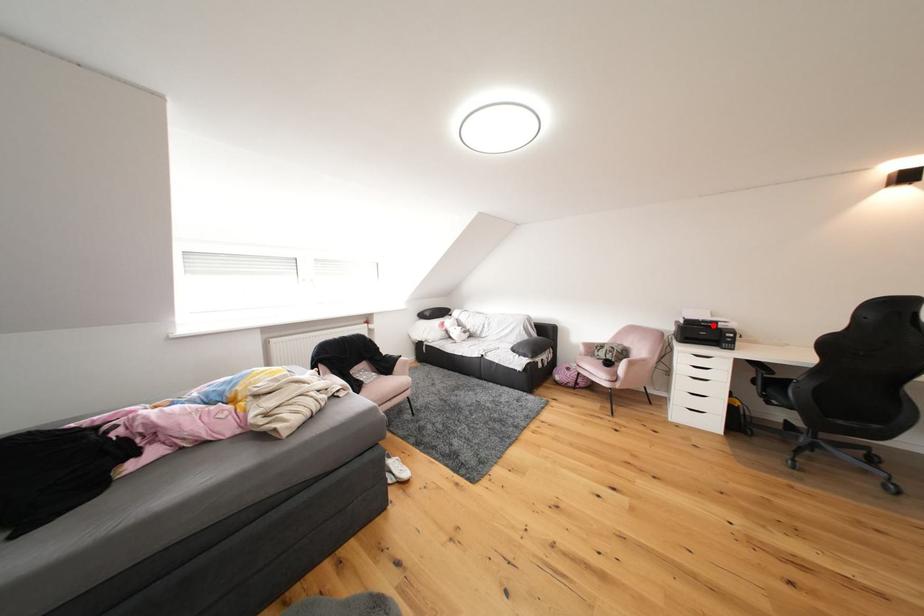
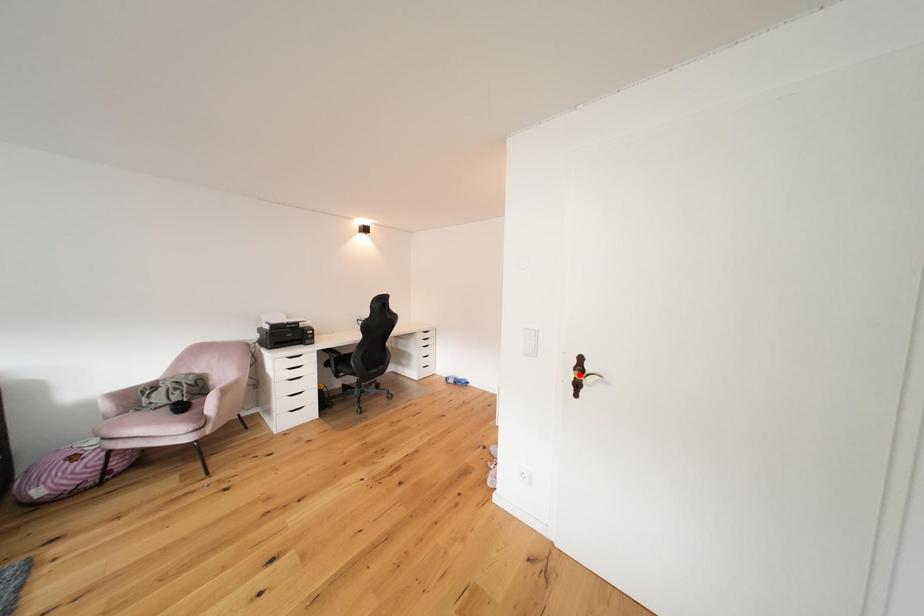
I am providing you with two images of the same scene from different viewpoints. A red point is marked on the first image and another point is marked on the second image. Do the highlighted points in image1 and image2 indicate the same real-world spot?

No